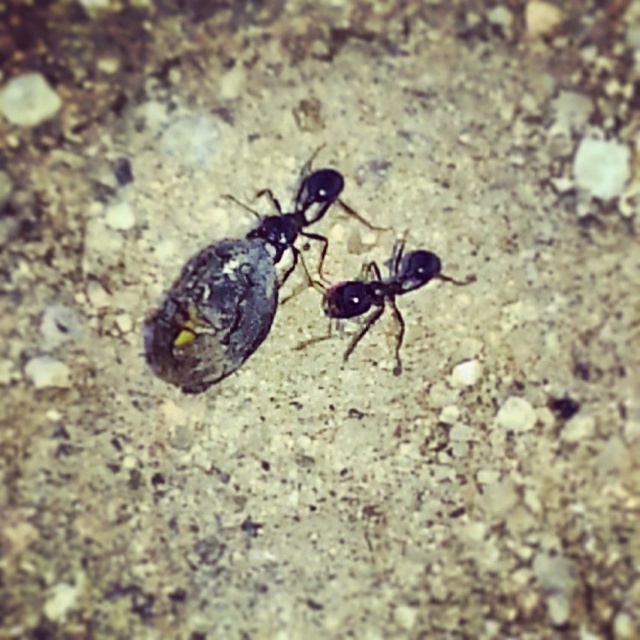
Is black matte ant at center closer to the viewer compared to black glossy ant at center?

Yes, black matte ant at center is closer to the viewer.

Between point (154, 339) and point (346, 312), which one is positioned behind?

Positioned behind is point (346, 312).

Is point (253, 288) farther from viewer compared to point (353, 301)?

No, it is not.

What are the coordinates of `black matte ant at center` in the screenshot? It's located at (236, 289).